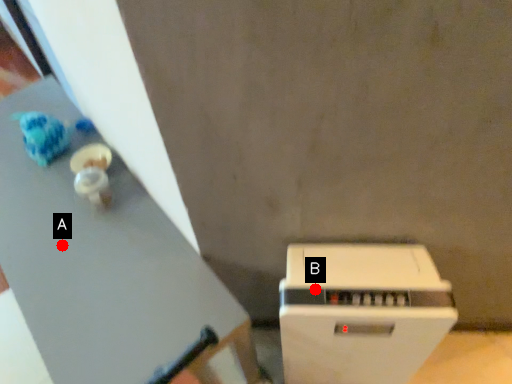
Question: Two points are circled on the image, labeled by A and B beside each circle. Among these points, which one is nearest to the camera?

Choices:
 (A) A is closer
 (B) B is closer

Answer: (B)